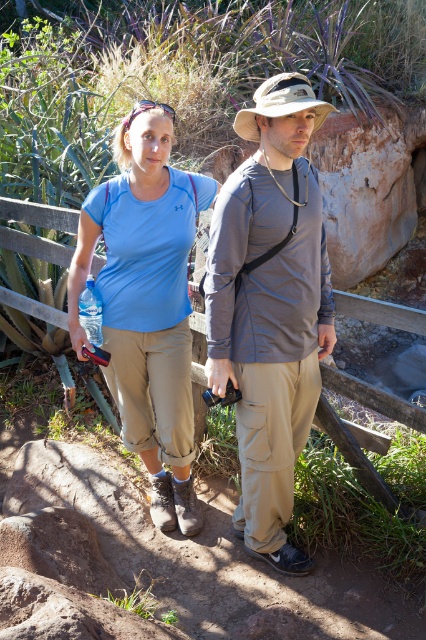
Question: Considering the relative positions of matte blue t-shirt at center and tan fabric hat at center in the image provided, where is matte blue t-shirt at center located with respect to tan fabric hat at center?

Choices:
 (A) above
 (B) below

Answer: (B)

Question: Which is farther from the matte blue t-shirt at center?

Choices:
 (A) matte blue shirt at center
 (B) gray fabric shirt at center
 (C) tan fabric hat at center

Answer: (C)

Question: Where is gray fabric shirt at center located in relation to tan fabric hat at center in the image?

Choices:
 (A) below
 (B) above

Answer: (A)

Question: Does matte blue shirt at center appear under tan fabric hat at center?

Choices:
 (A) no
 (B) yes

Answer: (B)

Question: Among these points, which one is farthest from the camera?

Choices:
 (A) (276, 292)
 (B) (155, 400)
 (C) (307, 96)

Answer: (B)

Question: Among these points, which one is nearest to the camera?

Choices:
 (A) (103, 337)
 (B) (261, 106)
 (C) (244, 486)
 (D) (218, 252)

Answer: (B)